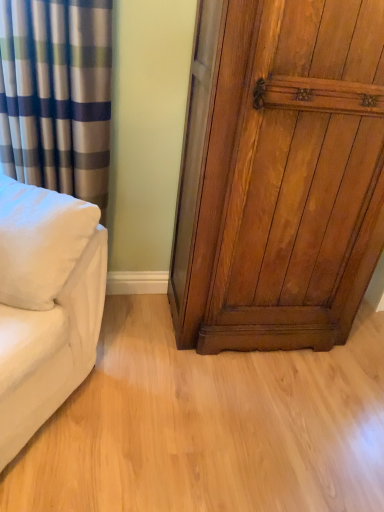
Where is `free space in front of shiny brown wood door at right`? The width and height of the screenshot is (384, 512). free space in front of shiny brown wood door at right is located at coordinates (x=251, y=413).